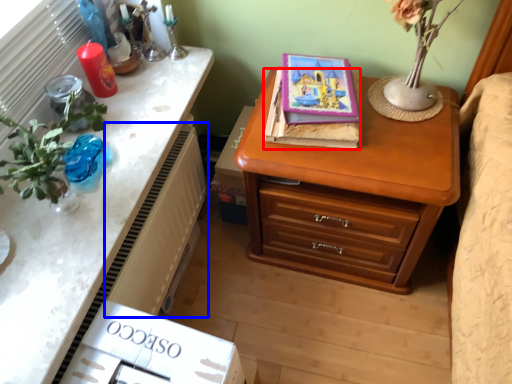
Question: Among these objects, which one is farthest to the camera, book (highlighted by a red box) or radiator (highlighted by a blue box)?

Choices:
 (A) book
 (B) radiator

Answer: (A)